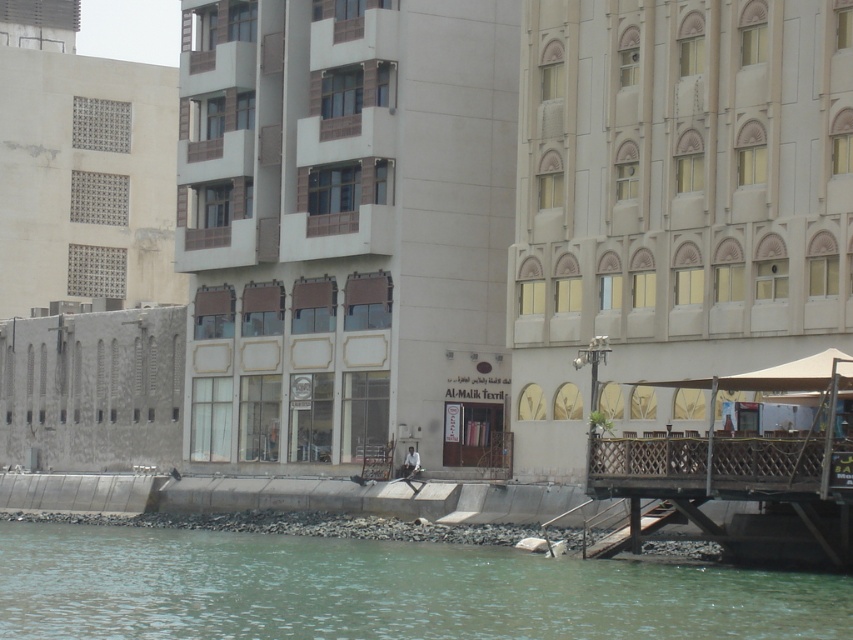
Which of these two, beige stone building at center or greenish water at lower left, stands shorter?

greenish water at lower left

Between point (643, 148) and point (109, 620), which one is positioned behind?

The point (643, 148) is behind.

You are a GUI agent. You are given a task and a screenshot of the screen. Output one action in this format:
    pyautogui.click(x=<x>, y=<y>)
    Task: Click on the beige stone building at center
    
    Given the screenshot: What is the action you would take?
    pyautogui.click(x=672, y=204)

Does greenish water at lower left appear under brown wooden dock at lower right?

Yes.

Does point (444, 616) come farther from viewer compared to point (775, 365)?

That is False.

Find the location of a particular element. Image resolution: width=853 pixels, height=640 pixels. greenish water at lower left is located at coordinates (380, 589).

Which of these two, beige concrete building at center or greenish water at lower left, stands shorter?

With less height is greenish water at lower left.

Does beige concrete building at center appear over greenish water at lower left?

Correct, beige concrete building at center is located above greenish water at lower left.

Is point (401, 52) farther from camera compared to point (310, 609)?

Yes, it is behind point (310, 609).

The image size is (853, 640). I want to click on beige concrete building at center, so click(346, 228).